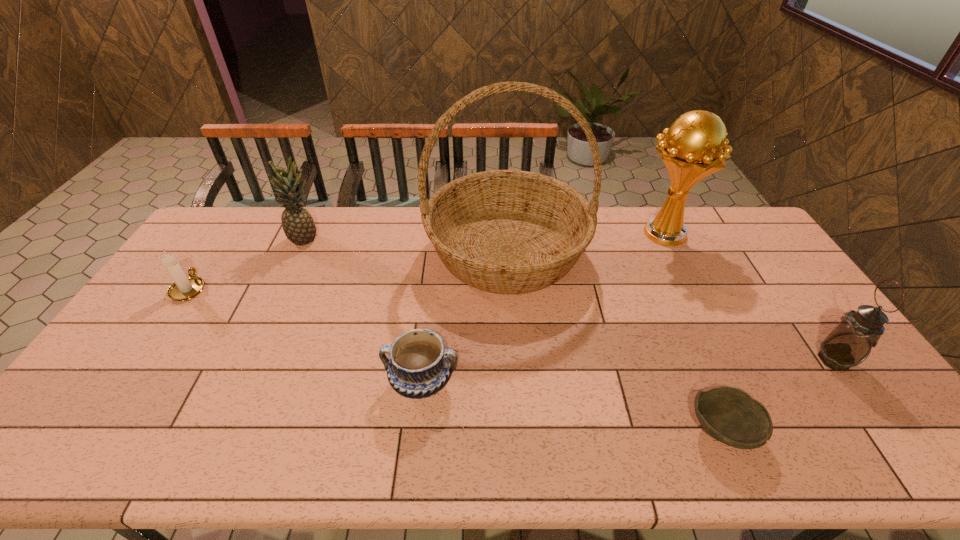
In order to click on blank space located at the front of the second tallest object where the globe is prominent in this screenshot , I will do `click(550, 233)`.

The image size is (960, 540). I want to click on vacant space situated 0.090m on the left of the sixth object from right to left, so click(x=264, y=239).

Where is `vacant space located 0.220m on the front of the oil lamp`? The height and width of the screenshot is (540, 960). vacant space located 0.220m on the front of the oil lamp is located at coordinates (903, 457).

This screenshot has width=960, height=540. Find the location of `free spot located on the handle side of the candle holder`. free spot located on the handle side of the candle holder is located at coordinates (213, 253).

Identify the location of free point located 0.390m on the handle side of the candle holder. The height and width of the screenshot is (540, 960). (245, 207).

Where is `free spot located on the handle side of the candle holder`? The width and height of the screenshot is (960, 540). free spot located on the handle side of the candle holder is located at coordinates (215, 250).

The width and height of the screenshot is (960, 540). What are the coordinates of `vacant space located 0.110m on the left of the pottery` in the screenshot? It's located at (343, 382).

At what (x,y) coordinates should I click in order to perform the action: click on vacant space situated 0.340m on the left of the shortest object. Please return your answer as a coordinate pair (x, y). Image resolution: width=960 pixels, height=540 pixels. Looking at the image, I should click on (545, 430).

This screenshot has width=960, height=540. What are the coordinates of `basket that is at the far edge` in the screenshot? It's located at (503, 231).

Image resolution: width=960 pixels, height=540 pixels. Identify the location of trophy_cup present at the far edge. (692, 150).